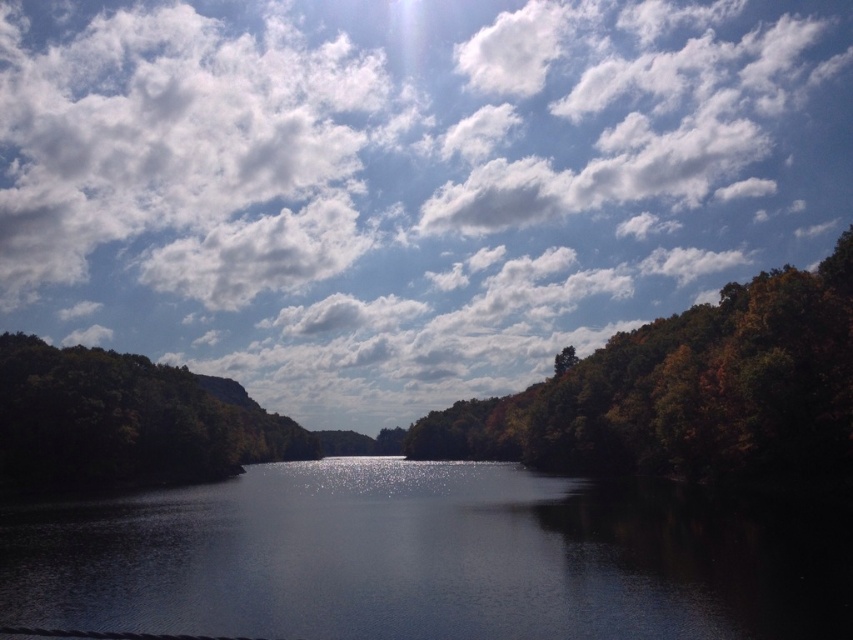
You are an observer looking at the serene landscape. You notice the white fluffy cloud at upper center and the autumn leaves at right. Which object is positioned higher in the sky?

The white fluffy cloud at upper center is positioned higher in the sky than the autumn leaves at right.

You are an artist planning to paint the scene. You want to ensure the white fluffy cloud at upper center and autumn leaves at right are proportionally accurate. Which object should you paint larger?

The white fluffy cloud at upper center should be painted larger because it has a larger size compared to the autumn leaves at right according to the description.